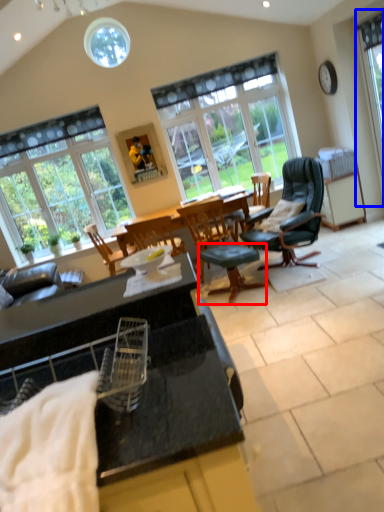
Question: Among these objects, which one is nearest to the camera, stool (highlighted by a red box) or window (highlighted by a blue box)?

Choices:
 (A) stool
 (B) window

Answer: (A)